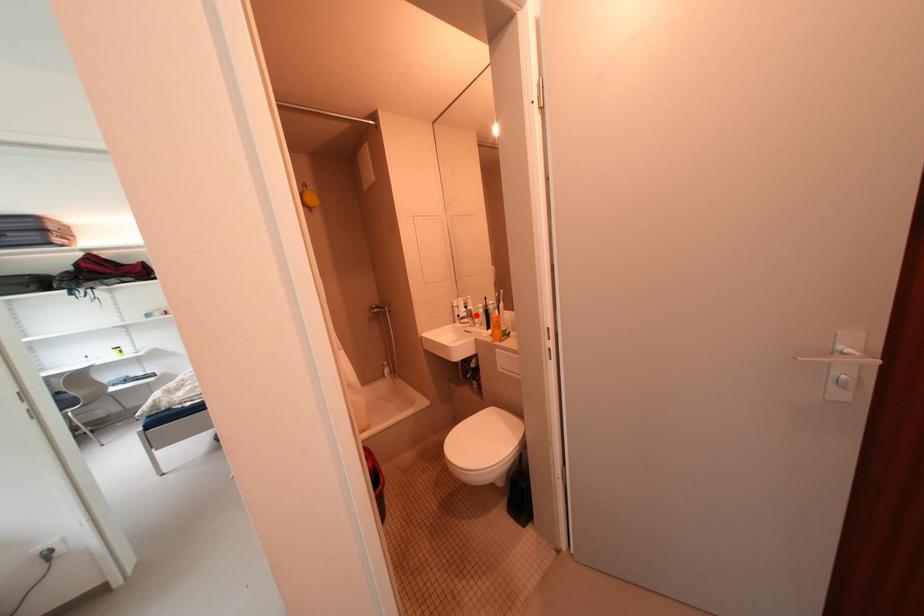
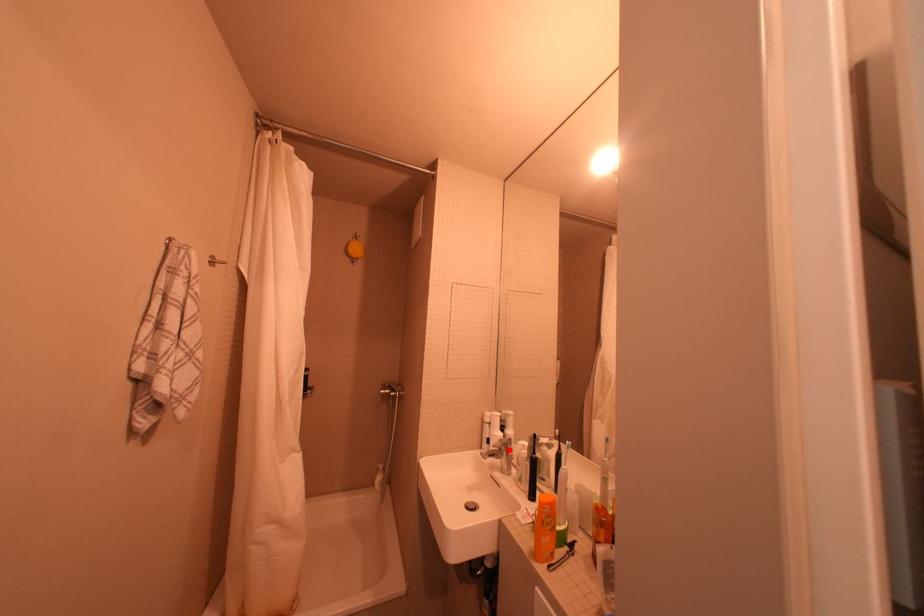
I am providing you with two images of the same scene from different viewpoints. A red point is marked on the first image and another point is marked on the second image. Are the points marked in image1 and image2 representing the same 3D position?

Yes